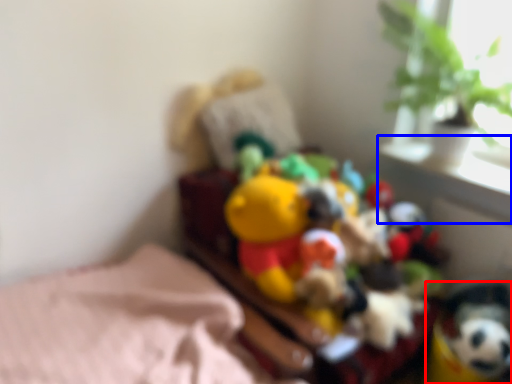
Question: Which object appears closest to the camera in this image, toy (highlighted by a red box) or window sill (highlighted by a blue box)?

Choices:
 (A) toy
 (B) window sill

Answer: (A)